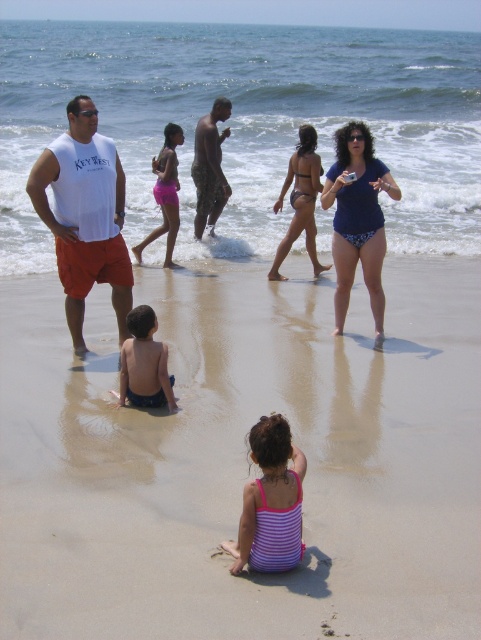
You are a photographer trying to capture a group photo of the purple striped swimsuit at center and the camouflage pants at center. Since you want to ensure both subjects are fully visible in the frame, which subject should you position closer to the camera to avoid cropping?

The purple striped swimsuit at center has a lesser width compared to camouflage pants at center, so you should position the purple striped swimsuit at center closer to the camera to ensure it is fully visible without cropping.

You are a photographer trying to capture a shot of the white sleeveless shirt at left and the pink fabric shorts at center. From your current position, which object is closer to the camera?

The white sleeveless shirt at left is positioned under the pink fabric shorts at center, so the pink fabric shorts at center is closer to the camera.

You are a photographer trying to capture a photo of both the white sleeveless shirt at left and the pink fabric shorts at center. The camera you are using has a maximum focus range of 10 feet. Will you be able to include both in the same frame without moving the camera?

The white sleeveless shirt at left and pink fabric shorts at center are 10.95 feet apart, which is slightly beyond the camera maximum focus range of 10 feet. Therefore, you cannot include both in the same frame without moving the camera.